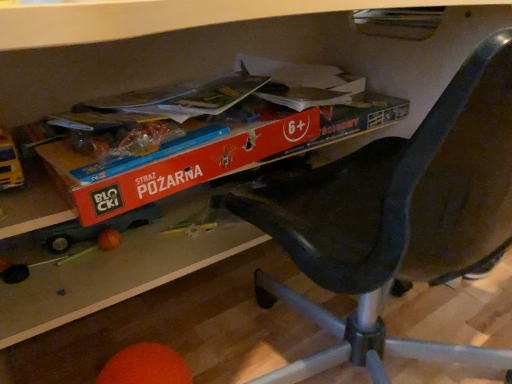
The height and width of the screenshot is (384, 512). In order to click on red cardboard box at center in this screenshot , I will do `click(178, 165)`.

Describe the element at coordinates (178, 165) in the screenshot. I see `red cardboard box at center` at that location.

You are a GUI agent. You are given a task and a screenshot of the screen. Output one action in this format:
    pyautogui.click(x=<x>, y=<y>)
    Task: Click on the red cardboard box at center
    The height and width of the screenshot is (384, 512).
    Given the screenshot: What is the action you would take?
    click(178, 165)